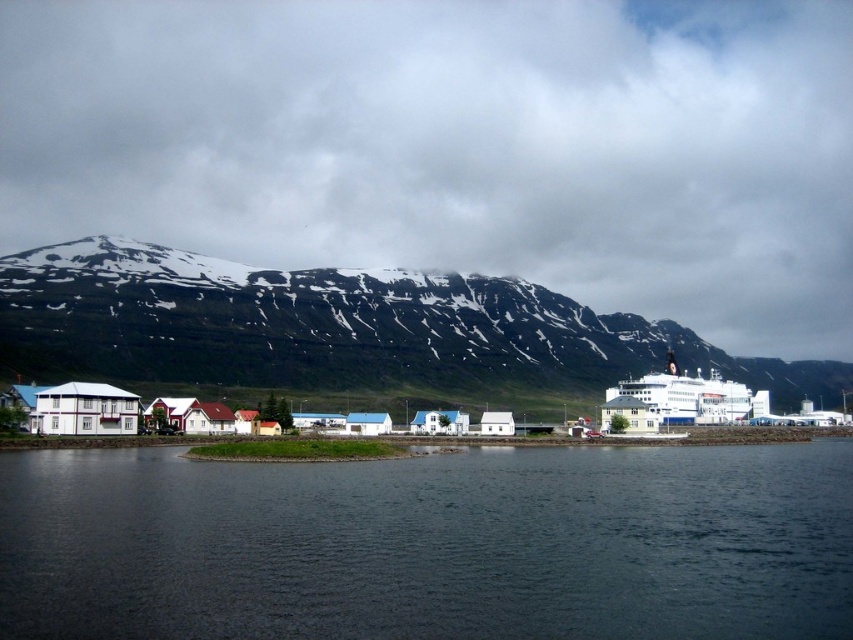
Question: Which of the following is the farthest from the observer?

Choices:
 (A) (285, 545)
 (B) (695, 401)
 (C) (22, 188)
 (D) (680, 355)

Answer: (C)

Question: Estimate the real-world distances between objects in this image. Which object is farther from the dark blue water at center?

Choices:
 (A) green grassy mountain at upper center
 (B) white fluffy cloud at upper center
 (C) white matte ferry at right

Answer: (B)

Question: Does dark blue water at center have a larger size compared to green grassy mountain at upper center?

Choices:
 (A) yes
 (B) no

Answer: (B)

Question: Considering the relative positions of white fluffy cloud at upper center and white matte ferry at right in the image provided, where is white fluffy cloud at upper center located with respect to white matte ferry at right?

Choices:
 (A) below
 (B) above

Answer: (B)

Question: Can you confirm if dark blue water at center is bigger than green grassy mountain at upper center?

Choices:
 (A) no
 (B) yes

Answer: (A)

Question: Which object is farther from the camera taking this photo?

Choices:
 (A) white matte ferry at right
 (B) green grassy mountain at upper center
 (C) white fluffy cloud at upper center
 (D) dark blue water at center

Answer: (C)